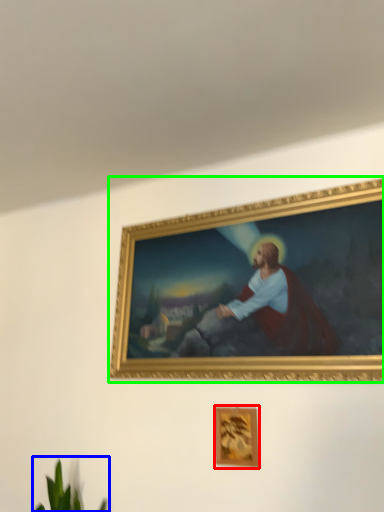
Question: Which object is positioned closest to picture frame (highlighted by a red box)? Select from plant (highlighted by a blue box) and picture frame (highlighted by a green box).

Choices:
 (A) plant
 (B) picture frame

Answer: (B)